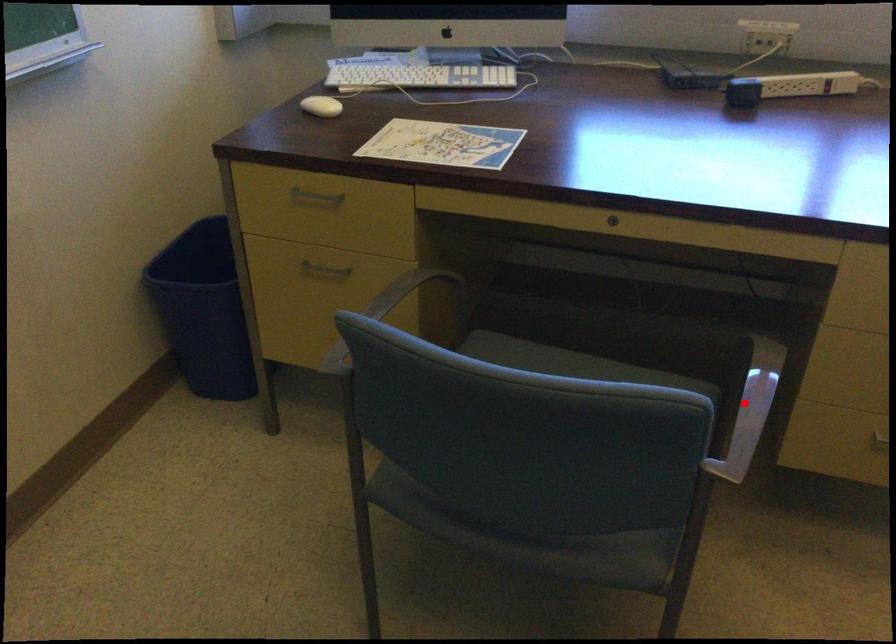
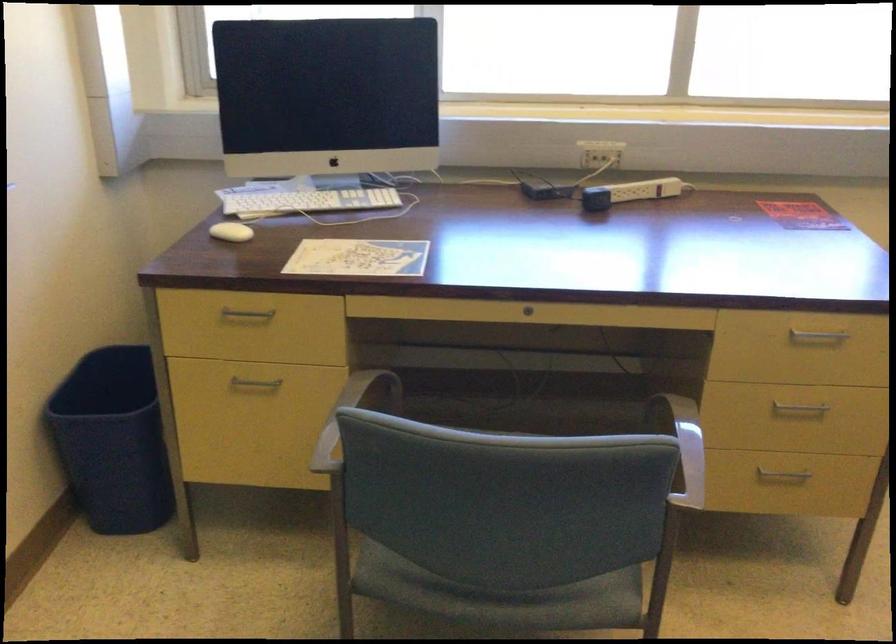
Question: I am providing you with two images of the same scene from different viewpoints. A red point is marked on the first image. Can you still see the location of the red point in image 2?

Choices:
 (A) Yes
 (B) No

Answer: (A)